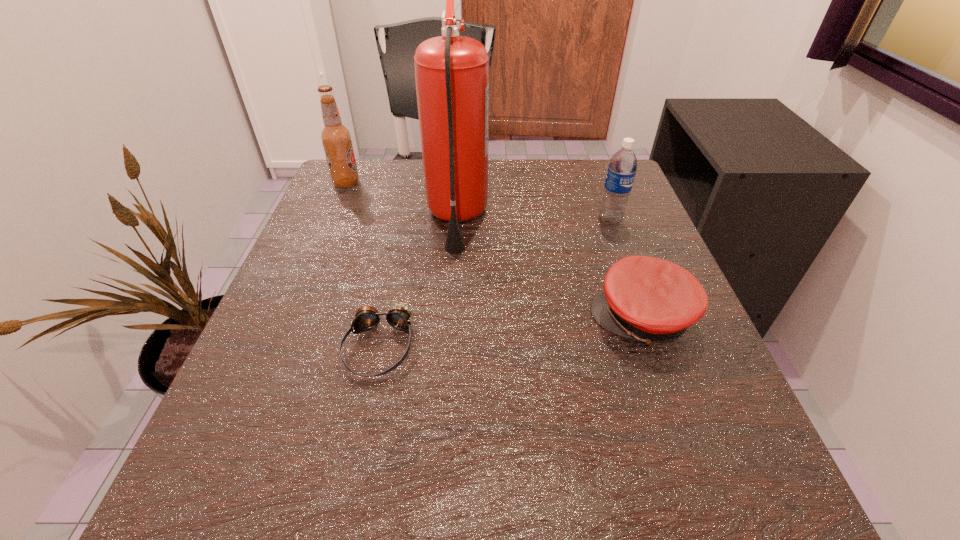
Image resolution: width=960 pixels, height=540 pixels. Find the location of `vacant area situated 0.350m on the front of the fourth tallest object with an emblem`. vacant area situated 0.350m on the front of the fourth tallest object with an emblem is located at coordinates (384, 319).

Identify the location of free space located on the front of the fourth tallest object with an emblem. This screenshot has width=960, height=540. (563, 319).

The height and width of the screenshot is (540, 960). I want to click on free space located 0.150m through the lenses of the shortest object, so click(349, 485).

Where is `fire extinguisher located at the far edge`? The width and height of the screenshot is (960, 540). fire extinguisher located at the far edge is located at coordinates (451, 72).

In order to click on beer bottle that is at the far edge in this screenshot , I will do `click(336, 138)`.

Identify the location of water bottle present at the far edge. tap(622, 167).

Find the location of a particular element. beer bottle positioned at the left edge is located at coordinates (336, 138).

Where is `goggles at the left edge`? Image resolution: width=960 pixels, height=540 pixels. goggles at the left edge is located at coordinates (399, 316).

The image size is (960, 540). In order to click on water bottle situated at the right edge in this screenshot , I will do `click(622, 167)`.

Where is `cap present at the right edge`? This screenshot has width=960, height=540. cap present at the right edge is located at coordinates (652, 300).